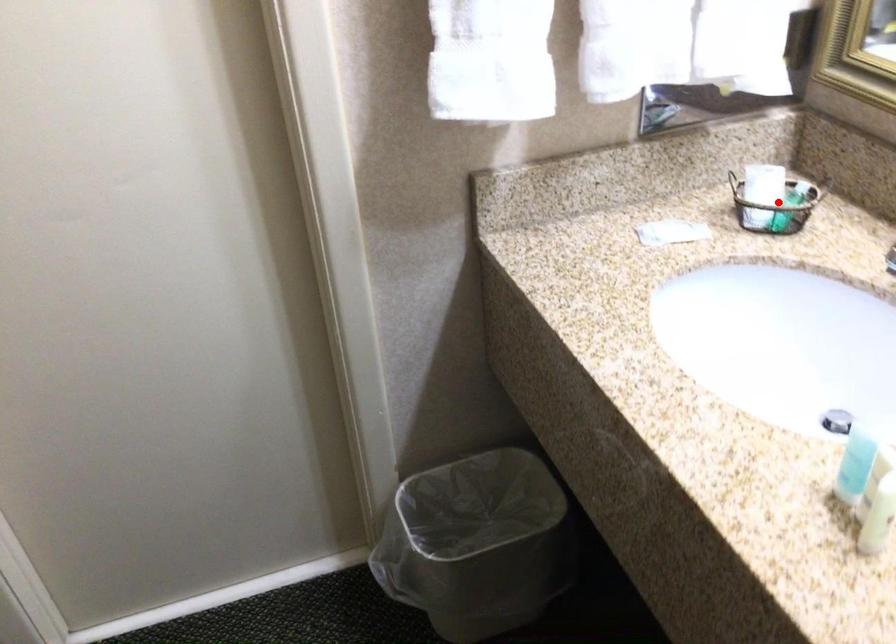
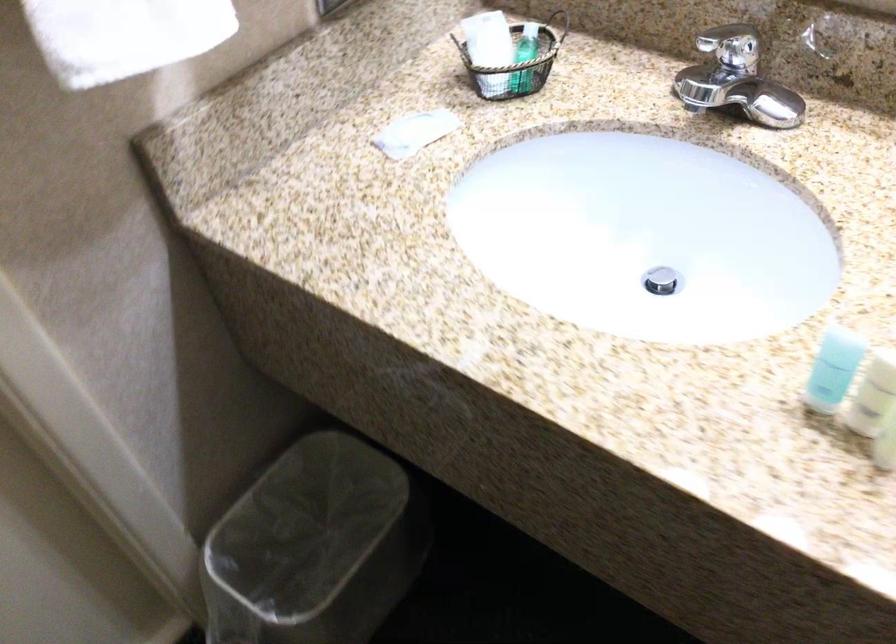
Locate, in the second image, the point that corresponds to the highlighted location in the first image.

(524, 59)